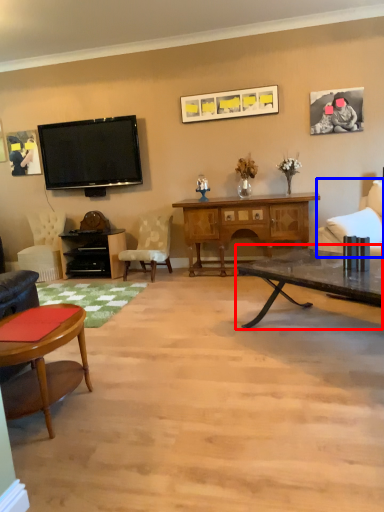
Question: Which object appears farthest to the camera in this image, coffee table (highlighted by a red box) or chair (highlighted by a blue box)?

Choices:
 (A) coffee table
 (B) chair

Answer: (B)